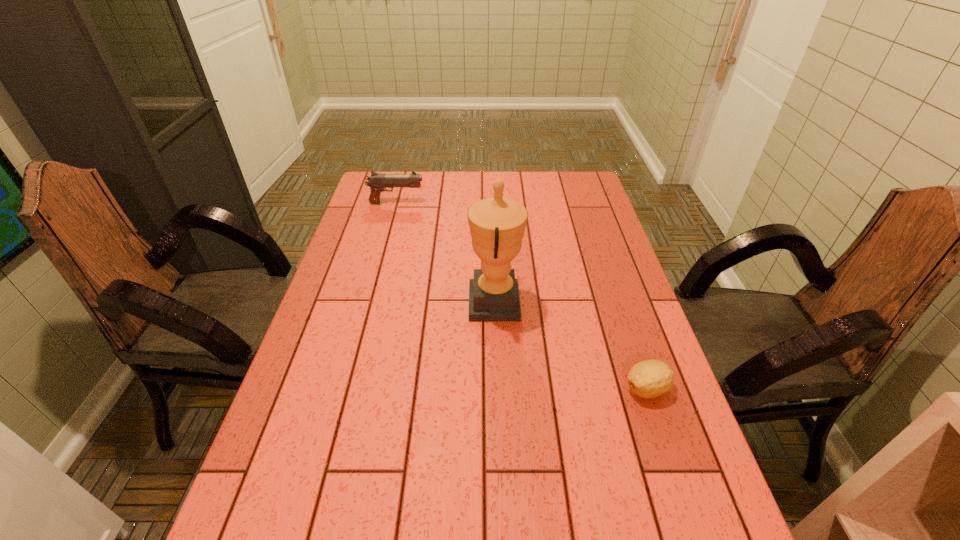
The image size is (960, 540). Find the location of `the second object from left to right`. the second object from left to right is located at coordinates [497, 225].

Locate an element on the screen. This screenshot has height=540, width=960. the second farthest object is located at coordinates (497, 225).

The width and height of the screenshot is (960, 540). Find the location of `the farthest object`. the farthest object is located at coordinates (377, 182).

Find the location of a particular element. This screenshot has height=540, width=960. the leftmost object is located at coordinates (377, 182).

Locate an element on the screen. The width and height of the screenshot is (960, 540). the nearest object is located at coordinates (648, 379).

Locate an element on the screen. This screenshot has width=960, height=540. the shortest object is located at coordinates 648,379.

I want to click on vacant space located 0.280m at the front of the second object from left to right with handles, so click(x=370, y=302).

This screenshot has width=960, height=540. I want to click on vacant space located 0.140m at the front of the second object from left to right with handles, so tap(420, 302).

Find the location of `vacant space located 0.360m at the front of the second object from left to right with handles`. vacant space located 0.360m at the front of the second object from left to right with handles is located at coordinates (341, 302).

Where is `free location located 0.150m in the direction the gun is aimed`? free location located 0.150m in the direction the gun is aimed is located at coordinates tap(465, 203).